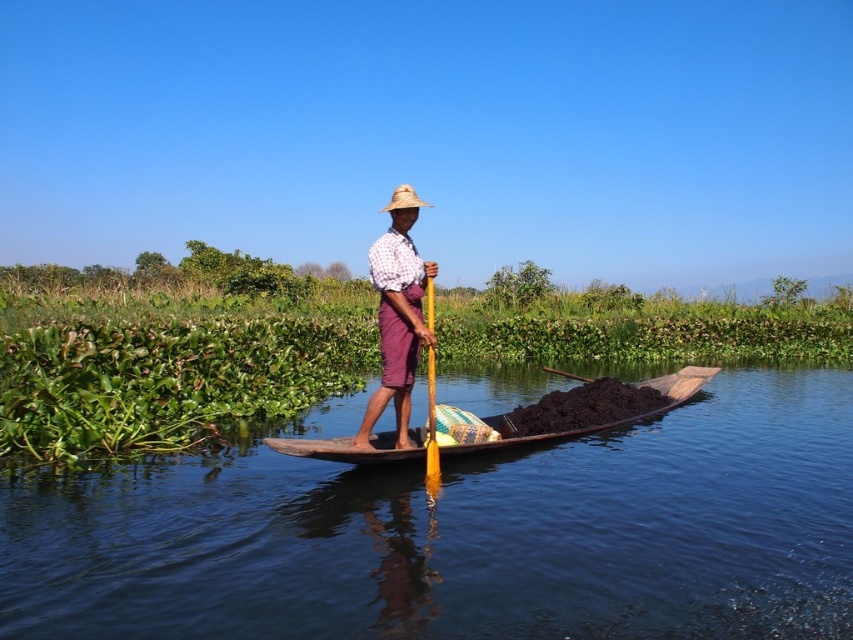
You are a photographer trying to capture the brown wooden boat at center and the straw hat at center in a single frame. Based on their sizes, which object should you focus on first to ensure both are in the frame?

The brown wooden boat at center is shorter than the straw hat at center, so you should focus on the straw hat at center first to ensure both are in the frame.